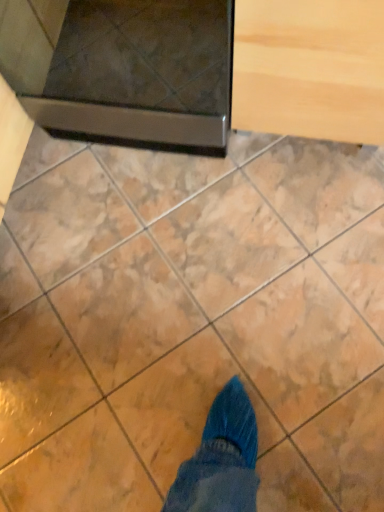
Question: Looking at the image, does metallic dark gray oven at upper left seem bigger or smaller compared to light wood drawer at upper right?

Choices:
 (A) big
 (B) small

Answer: (A)

Question: From the image's perspective, is metallic dark gray oven at upper left located above or below light wood drawer at upper right?

Choices:
 (A) below
 (B) above

Answer: (B)

Question: Estimate the real-world distances between objects in this image. Which object is closer to the light wood drawer at upper right?

Choices:
 (A) metallic dark gray oven at upper left
 (B) marble at upper center

Answer: (A)

Question: Considering the real-world distances, which object is farthest from the marble at upper center?

Choices:
 (A) metallic dark gray oven at upper left
 (B) light wood drawer at upper right

Answer: (B)